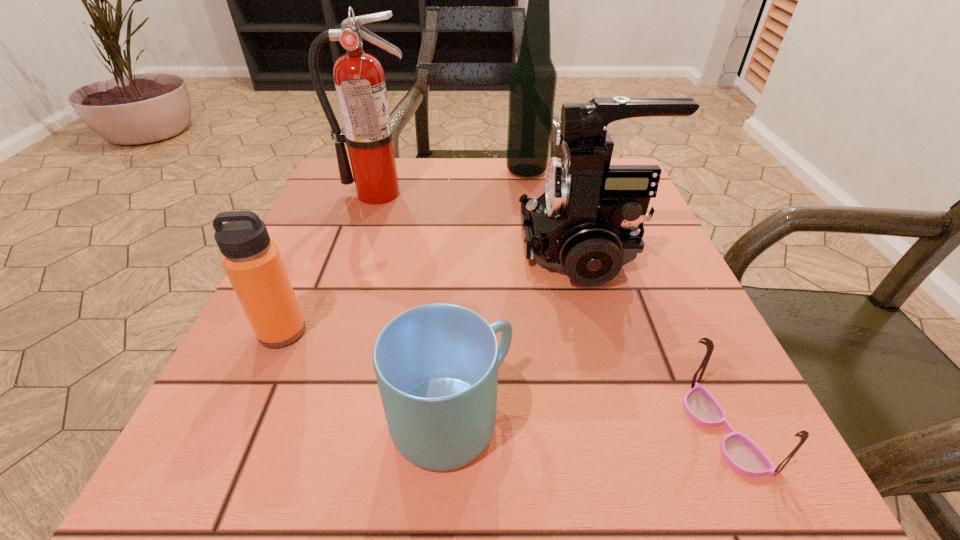
Where is `blank region between the fourth object from right to left and the shortest object`? blank region between the fourth object from right to left and the shortest object is located at coordinates (588, 425).

Locate an element on the screen. vacant area between the alcohol and the third nearest object is located at coordinates (404, 252).

Locate an element on the screen. This screenshot has width=960, height=540. object that can be found as the fifth closest to the shortest object is located at coordinates (359, 78).

Where is `object that stands as the fourth closest to the farthest object`? object that stands as the fourth closest to the farthest object is located at coordinates (436, 365).

Locate an element on the screen. Image resolution: width=960 pixels, height=540 pixels. blank space that satisfies the following two spatial constraints: 1. on the nozzle side of the shortest object; 2. on the right side of the second farthest object is located at coordinates (297, 430).

Where is `blank area in the image that satisfies the following two spatial constraints: 1. on the lens mount of the fourth shortest object; 2. on the right side of the spectacles`? blank area in the image that satisfies the following two spatial constraints: 1. on the lens mount of the fourth shortest object; 2. on the right side of the spectacles is located at coordinates (636, 430).

Find the location of a particular element. This screenshot has width=960, height=540. vacant space that satisfies the following two spatial constraints: 1. on the nozzle side of the third object from left to right; 2. on the left side of the fifth nearest object is located at coordinates (300, 420).